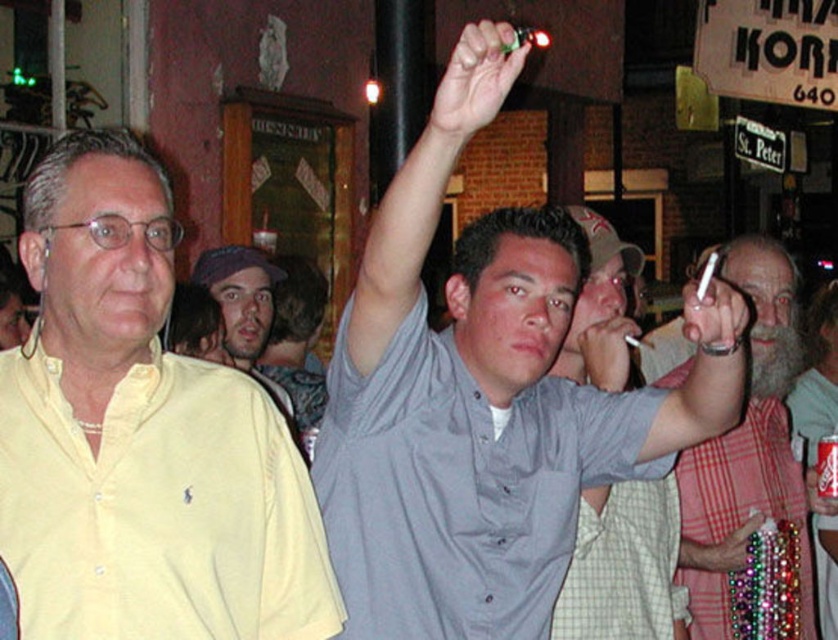
You are standing in the nighttime street scene and want to take a photo of both the point at coordinates point (547,401) and point (229,340). Which point should you focus on first to ensure both are in focus?

You should focus on point (547,401) first because it is closer to the camera than point (229,340), ensuring both are within the depth of field.

You are a photographer trying to capture a group photo of the yellow cotton shirt at left and the red plaid shirt at right in this nighttime scene. Since you want to ensure both are clearly visible, which person should you focus on more to account for their size difference?

The yellow cotton shirt at left occupies less space than the red plaid shirt at right, so you should focus more on the yellow cotton shirt at left to ensure it is clearly visible despite its smaller size.